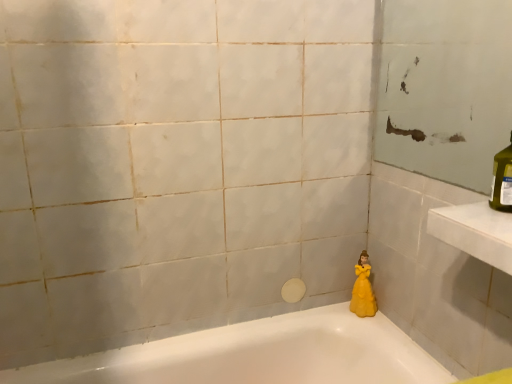
This screenshot has width=512, height=384. In order to click on free spot to the left of yellow matte doll at lower right in this screenshot , I will do `click(325, 313)`.